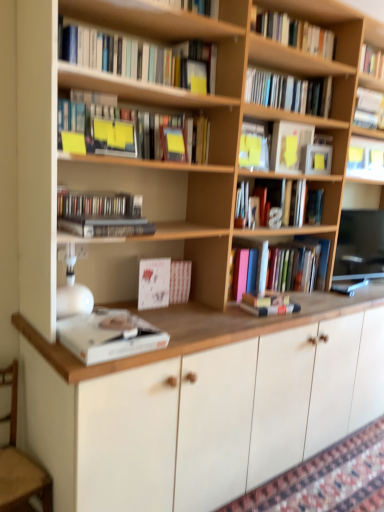
Identify the location of vacant space behind white matte book at lower left, which is the twelfth book in top-to-bottom order. (153, 314).